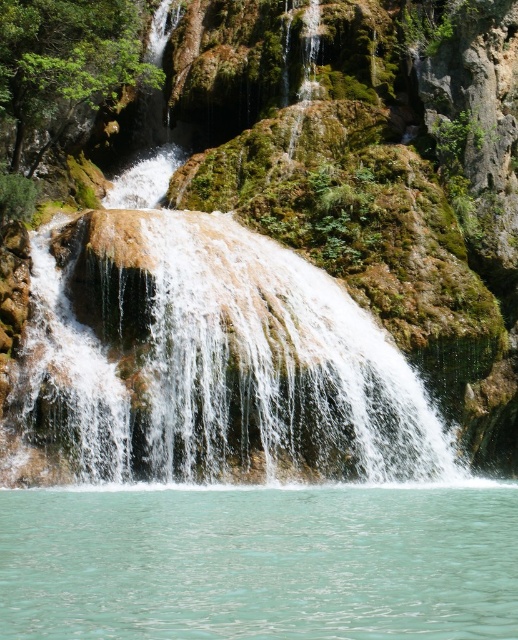
You are standing at the edge of the serene pool below the waterfall. You see the point marked as point (226,365) in the image. What is the nearest object to this point?

The nearest object to point (226,365) is the green mossy rock at center, as it is represented by that point.

You are planning to place a small decorative statue on the green mossy rock at center. Considering the size of the rock compared to the turquoise liquid at bottom, do you think the statue will fit comfortably on the rock?

The green mossy rock at center is bigger than the turquoise liquid at bottom, so the statue will fit comfortably on the green mossy rock at center.